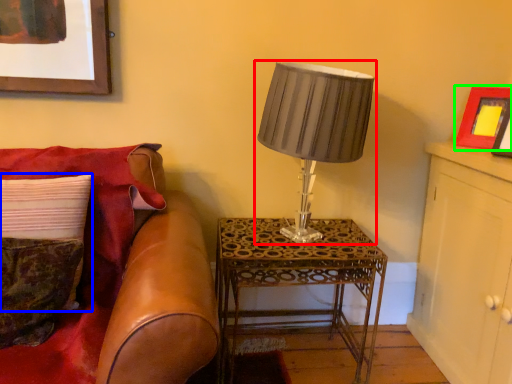
Question: Estimate the real-world distances between objects in this image. Which object is closer to lamp (highlighted by a red box), pillow (highlighted by a blue box) or picture frame (highlighted by a green box)?

Choices:
 (A) pillow
 (B) picture frame

Answer: (B)